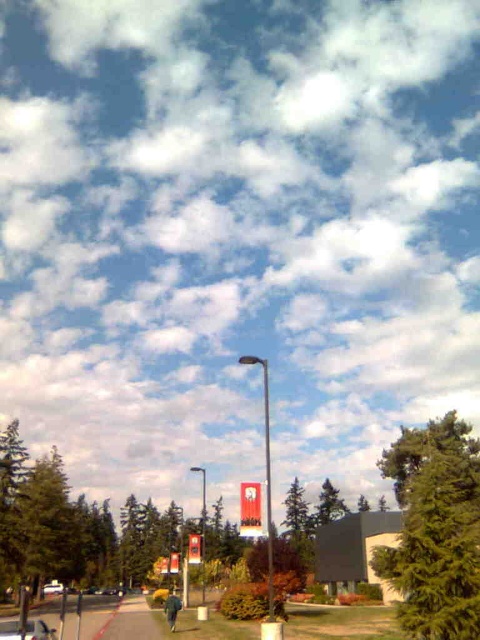
You are standing on the pathway and see the green fabric jacket at lower center and the white glossy car at center. Which object is nearer to you?

The green fabric jacket at lower center is closer to the viewer than the white glossy car at center.

You are a hiker who wants to know if the green textured tree at right is shorter than the green fabric jacket at lower center. Can you confirm this?

The green textured tree at right has a lesser height compared to the green fabric jacket at lower center, so yes, the green textured tree at right is shorter than the green fabric jacket at lower center.

You are standing at the green fabric jacket at lower center and want to walk to the green textured tree at right. The path is straight and clear. If your walking speed is 1.5 meters per second, how many seconds will it take you to reach the tree?

The distance between the green textured tree at right and green fabric jacket at lower center is 14.06 meters. At a speed of 1.5 meters per second, dividing 14.06 by 1.5 gives approximately 9.37 seconds. So, it will take roughly 9.4 seconds to reach the tree.